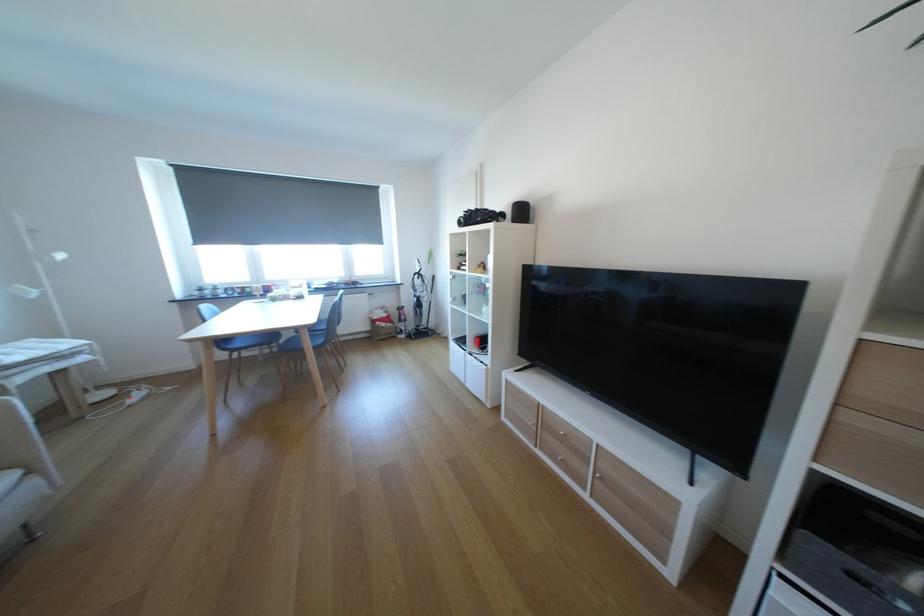
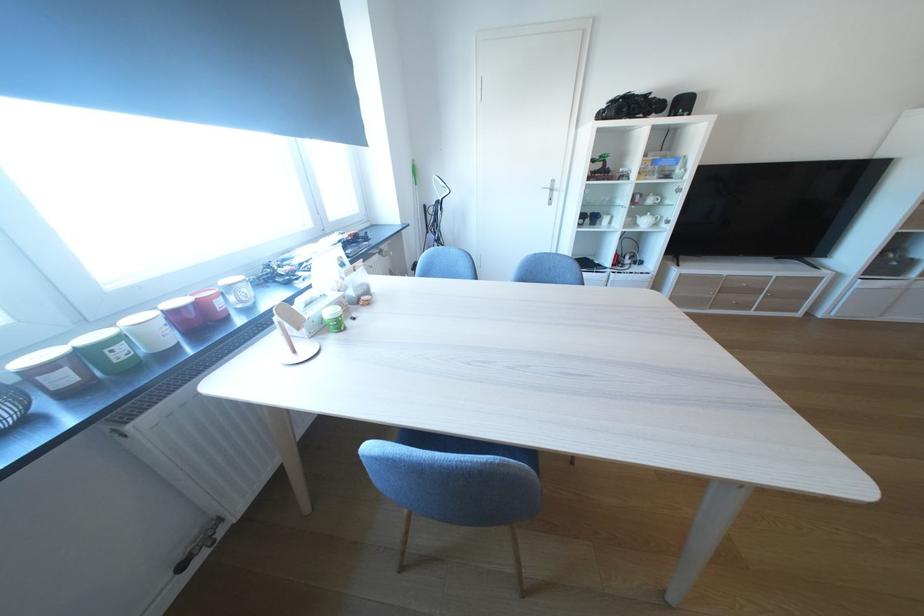
The point at (259,292) is marked in the first image. Where is the corresponding point in the second image?

(129, 354)